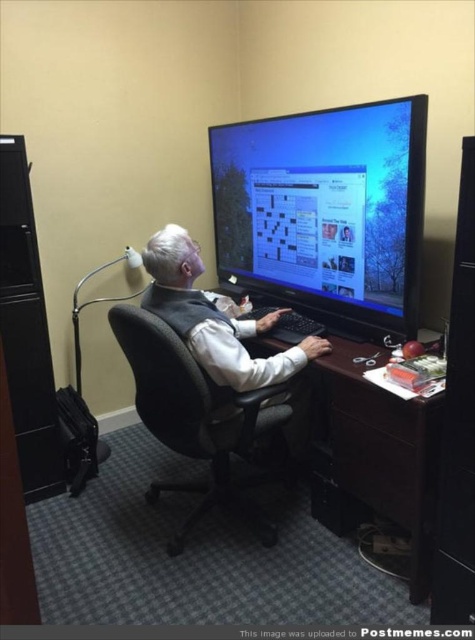
Is black mesh office chair at center further to the viewer compared to white matte vest at center?

No, black mesh office chair at center is in front of white matte vest at center.

Which is behind, point (257, 433) or point (256, 333)?

Positioned behind is point (256, 333).

At what (x,y) coordinates should I click in order to perform the action: click on black mesh office chair at center. Please return your answer as a coordinate pair (x, y). The width and height of the screenshot is (475, 640). Looking at the image, I should click on (196, 419).

Is point (364, 497) behind point (169, 234)?

No, (364, 497) is closer to viewer.

Does brown wood computer desk at center appear under white matte vest at center?

Correct, brown wood computer desk at center is located below white matte vest at center.

This screenshot has width=475, height=640. Describe the element at coordinates (374, 451) in the screenshot. I see `brown wood computer desk at center` at that location.

This screenshot has width=475, height=640. I want to click on brown wood computer desk at center, so click(374, 451).

Is matte black monitor at upper center above black mesh office chair at center?

Yes.

Between point (367, 307) and point (149, 420), which one is positioned behind?

The point (367, 307) is more distant.

Is point (260, 257) closer to viewer compared to point (180, 353)?

No, (260, 257) is further to viewer.

Locate an element on the screen. This screenshot has width=475, height=640. matte black monitor at upper center is located at coordinates (325, 211).